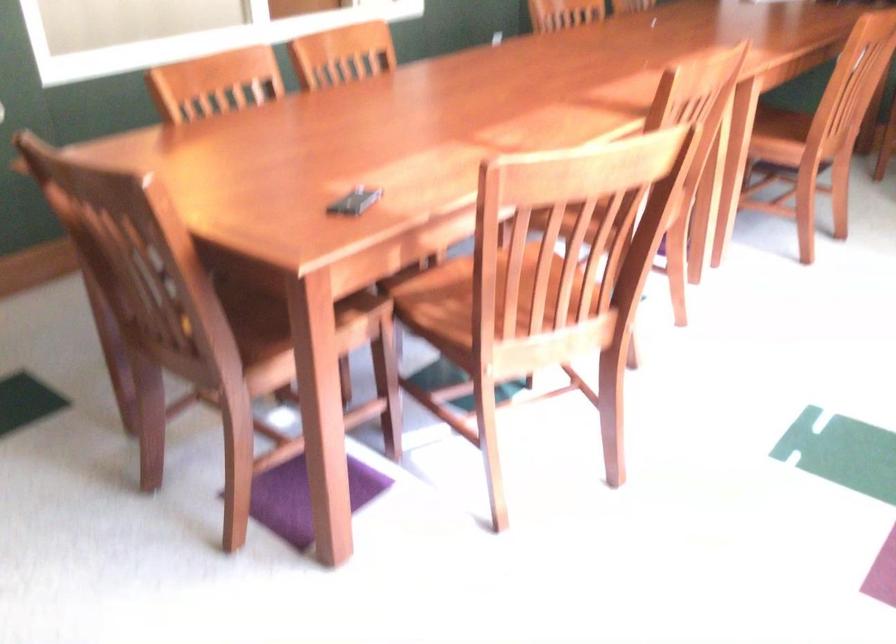
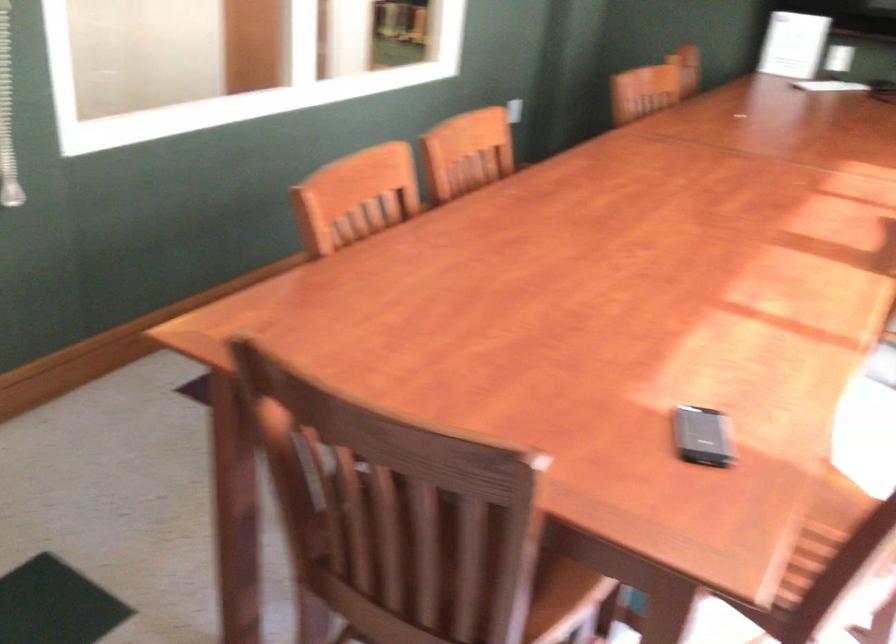
Question: Based on the continuous images, in which direction is the camera rotating? Reply with the corresponding letter.

Choices:
 (A) Left
 (B) Right
 (C) Up
 (D) Down

Answer: (B)